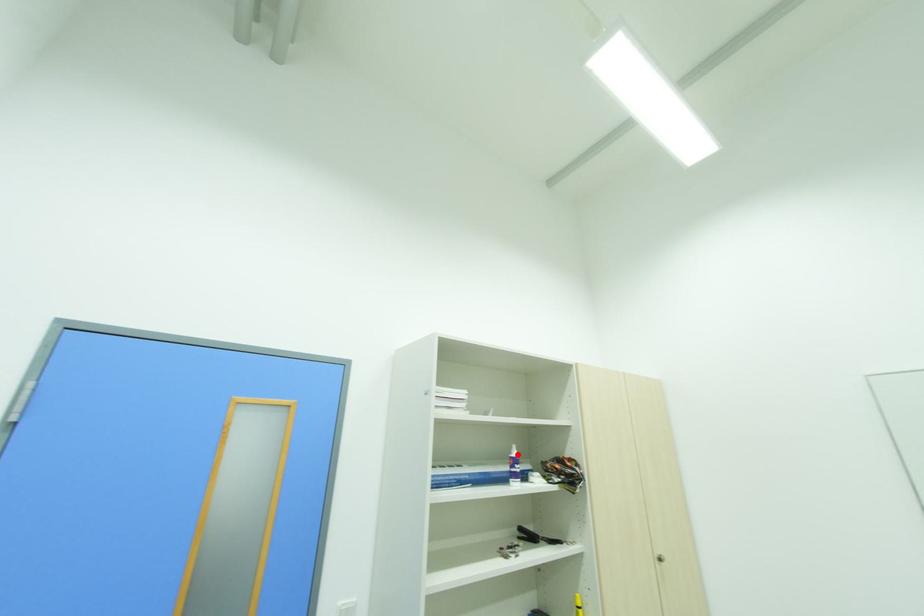
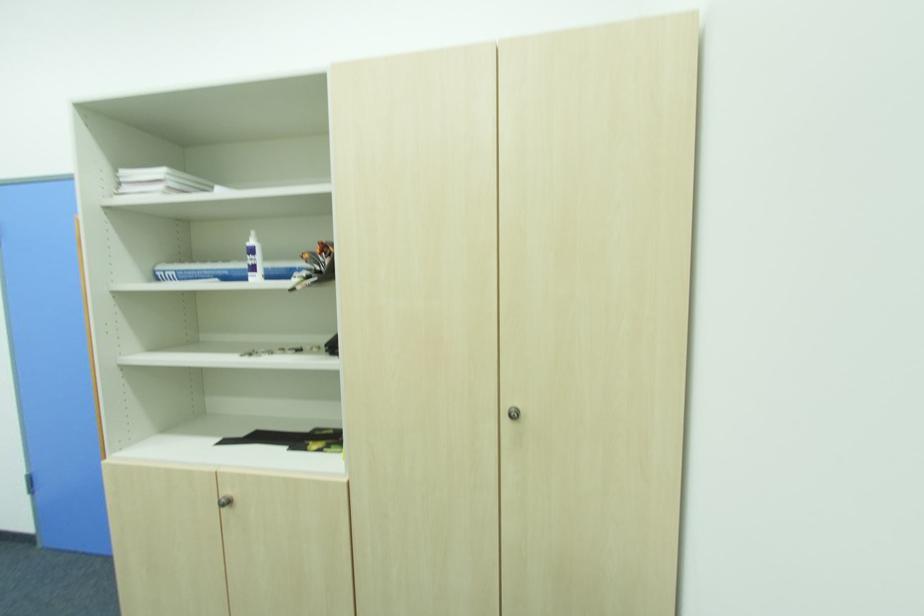
Locate, in the second image, the point that corresponds to the highlighted location in the first image.

(254, 243)